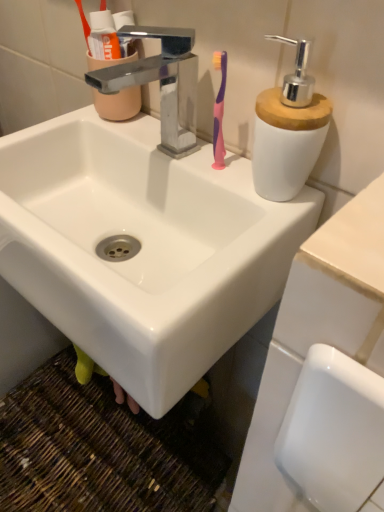
At what (x,y) coordinates should I click in order to perform the action: click on vacant space in front of translucent plastic cup at upper left. Please return your answer as a coordinate pair (x, y). Looking at the image, I should click on (136, 147).